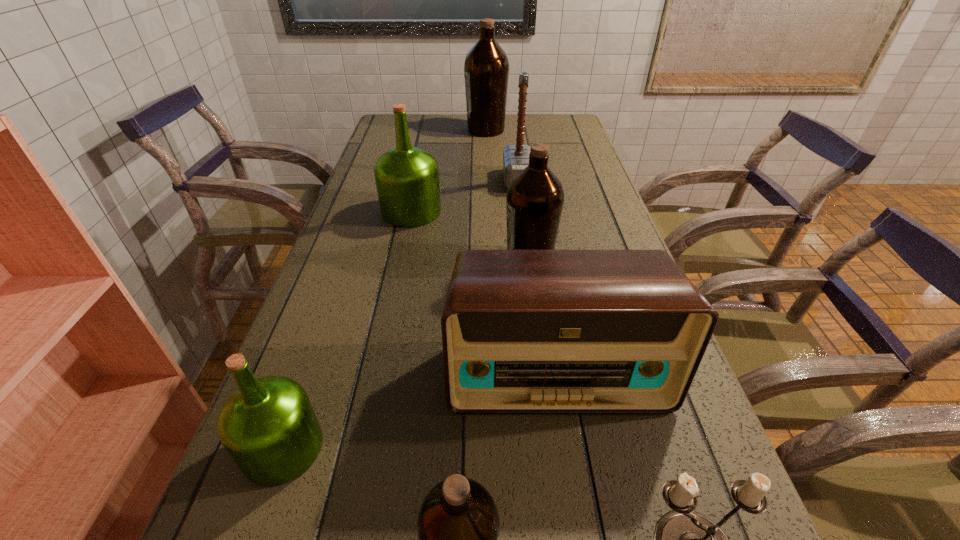
Find the location of a particular element. The width and height of the screenshot is (960, 540). the farthest brown olive oil is located at coordinates (486, 68).

Locate an element on the screen. This screenshot has width=960, height=540. the farthest object is located at coordinates click(x=486, y=68).

Identify the location of hammer. (515, 157).

I want to click on brown hammer, so click(x=515, y=157).

Locate an element on the screen. This screenshot has height=540, width=960. the farther green olive oil is located at coordinates (407, 178).

What are the coordinates of `the sixth nearest object` in the screenshot? It's located at (407, 178).

This screenshot has height=540, width=960. Identify the location of the fifth nearest object. (535, 197).

What are the coordinates of `the second nearest brown olive oil` in the screenshot? It's located at (535, 197).

The height and width of the screenshot is (540, 960). What are the coordinates of `radio receiver` in the screenshot? It's located at (523, 331).

Image resolution: width=960 pixels, height=540 pixels. What are the coordinates of `the second nearest olive oil` in the screenshot? It's located at (268, 426).